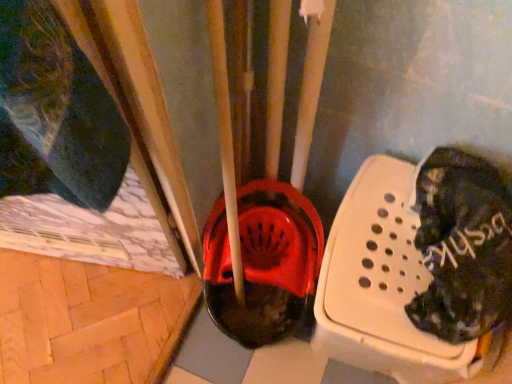
Question: Is dark blue fabric at left located outside black fabric shoe at right?

Choices:
 (A) yes
 (B) no

Answer: (A)

Question: Considering the relative positions of dark blue fabric at left and black fabric shoe at right in the image provided, is dark blue fabric at left to the left of black fabric shoe at right from the viewer's perspective?

Choices:
 (A) yes
 (B) no

Answer: (A)

Question: Is dark blue fabric at left behind black fabric shoe at right?

Choices:
 (A) yes
 (B) no

Answer: (B)

Question: From a real-world perspective, does dark blue fabric at left stand above black fabric shoe at right?

Choices:
 (A) no
 (B) yes

Answer: (A)

Question: Does dark blue fabric at left have a larger size compared to black fabric shoe at right?

Choices:
 (A) no
 (B) yes

Answer: (B)

Question: Can you confirm if dark blue fabric at left is shorter than black fabric shoe at right?

Choices:
 (A) no
 (B) yes

Answer: (A)

Question: Is black fabric shoe at right far away from dark blue fabric at left?

Choices:
 (A) no
 (B) yes

Answer: (A)

Question: From the image's perspective, is black fabric shoe at right below dark blue fabric at left?

Choices:
 (A) no
 (B) yes

Answer: (B)

Question: From a real-world perspective, is black fabric shoe at right physically below dark blue fabric at left?

Choices:
 (A) yes
 (B) no

Answer: (B)

Question: Can you confirm if black fabric shoe at right is positioned to the left of dark blue fabric at left?

Choices:
 (A) yes
 (B) no

Answer: (B)

Question: From a real-world perspective, is black fabric shoe at right on top of dark blue fabric at left?

Choices:
 (A) yes
 (B) no

Answer: (A)

Question: Is black fabric shoe at right positioned behind dark blue fabric at left?

Choices:
 (A) no
 (B) yes

Answer: (B)

Question: Considering their positions, is black fabric shoe at right located in front of or behind dark blue fabric at left?

Choices:
 (A) front
 (B) behind

Answer: (B)